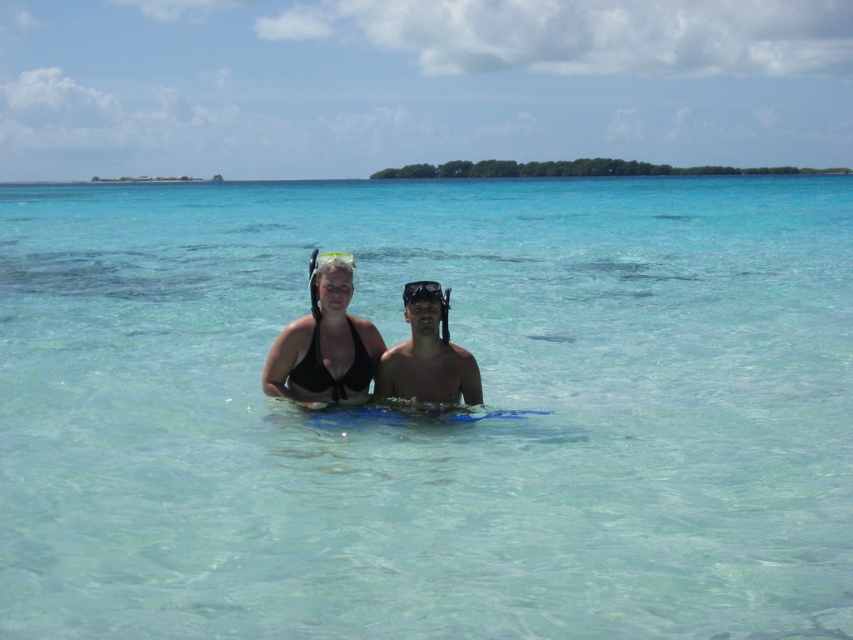
You are a lifeguard assessing the visibility of items in the water. You notice the black matte bikini top at center and the transparent plastic goggles at center. Which item is more likely to be visible from a distance?

The black matte bikini top at center is more likely to be visible from a distance because it has a solid color and is wider than the transparent plastic goggles at center, which may blend into the surroundings due to their transparency.

Based on the photo, you are a photographer trying to capture a photo of the clear plastic goggles at upper center without the transparent plastic goggles at center blocking it. Can you adjust your position to do so?

The clear plastic goggles at upper center is behind transparent plastic goggles at center, so you cannot see it without moving the transparent plastic goggles at center out of the way.

You are a photographer trying to capture the black matte bikini top at center and the transparent plastic goggles at center in a single shot. Which object should you focus on first if you want both to be in sharp focus?

The black matte bikini top at center is positioned under transparent plastic goggles at center, so focusing on the transparent plastic goggles at center first would ensure both are in focus since it is farther away from the camera.